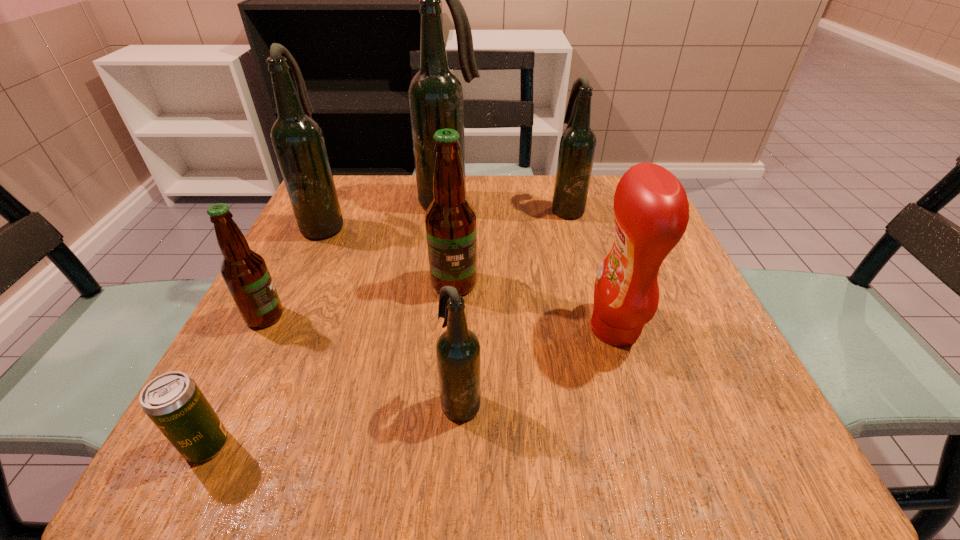
Where is `beer bottle object that ranks as the closest to the fifth shortest beer bottle`? The width and height of the screenshot is (960, 540). beer bottle object that ranks as the closest to the fifth shortest beer bottle is located at coordinates (435, 95).

Select which dark beer bottle appears as the third closest to the third nearest beer bottle. Please provide its 2D coordinates. Your answer should be formatted as a tuple, i.e. [(x, y)], where the tuple contains the x and y coordinates of a point satisfying the conditions above.

[(298, 141)]

Identify which dark beer bottle is located as the fourth nearest to the smaller brown beer bottle. Please provide its 2D coordinates. Your answer should be formatted as a tuple, i.e. [(x, y)], where the tuple contains the x and y coordinates of a point satisfying the conditions above.

[(577, 147)]

This screenshot has height=540, width=960. What are the coordinates of `blank space that satisfies the following two spatial constraints: 1. on the front side of the tallest beer bottle; 2. on the label of the smaller brown beer bottle` in the screenshot? It's located at (438, 316).

This screenshot has width=960, height=540. Identify the location of vacant point that satisfies the following two spatial constraints: 1. on the label of the fifth farthest beer bottle; 2. on the left side of the smallest dark beer bottle. (222, 401).

This screenshot has height=540, width=960. Identify the location of vacant position in the image that satisfies the following two spatial constraints: 1. on the back side of the smallest dark beer bottle; 2. on the label of the smaller brown beer bottle. (465, 316).